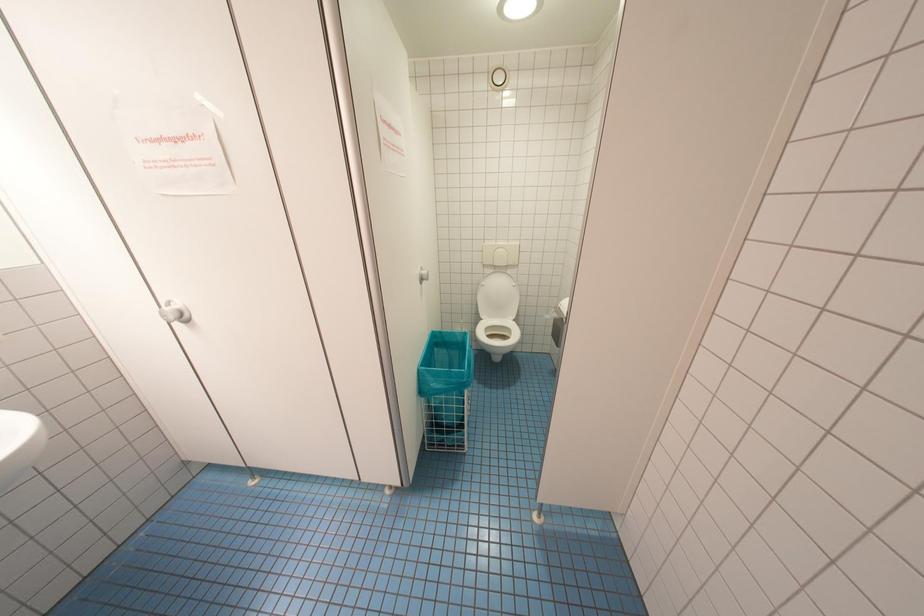
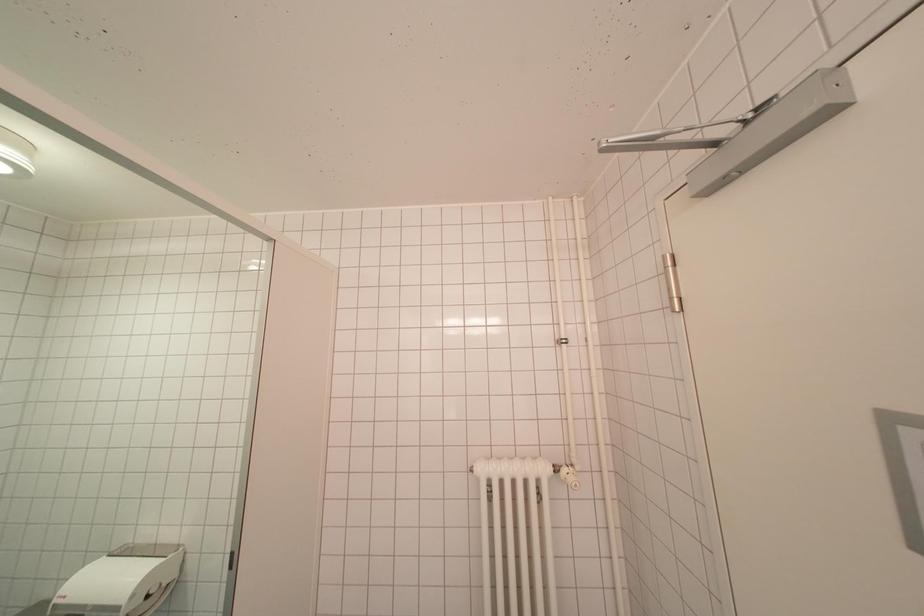
Question: The images are taken continuously from a first-person perspective. In which direction is your viewpoint rotating?

Choices:
 (A) Left
 (B) Right
 (C) Up
 (D) Down

Answer: (B)